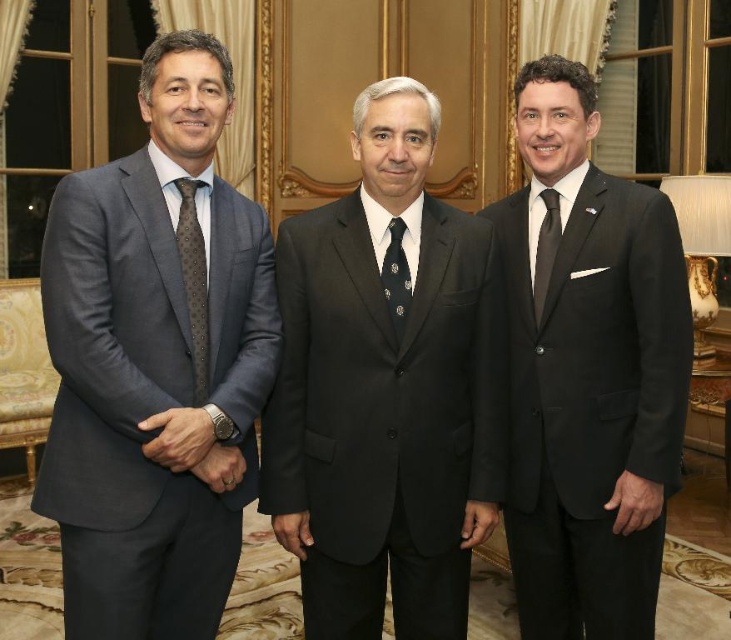
Who is positioned more to the left, dark gray dotted tie at left or black silk tie at right?

dark gray dotted tie at left is more to the left.

Which is in front, point (194, 240) or point (548, 205)?

Point (194, 240) is more forward.

Which is in front, point (185, 212) or point (539, 250)?

Positioned in front is point (185, 212).

Image resolution: width=731 pixels, height=640 pixels. Find the location of `dark gray dotted tie at left`. dark gray dotted tie at left is located at coordinates (194, 282).

Which is below, matte gray suit at left or dark gray dotted tie at left?

matte gray suit at left

Where is `matte gray suit at left`? The image size is (731, 640). matte gray suit at left is located at coordinates (156, 362).

Is matte black suit at right above black silk tie at right?

No, matte black suit at right is not above black silk tie at right.

Is matte black suit at right closer to camera compared to black silk tie at right?

Yes, it is in front of black silk tie at right.

What do you see at coordinates (588, 372) in the screenshot?
I see `matte black suit at right` at bounding box center [588, 372].

At what (x,y) coordinates should I click in order to perform the action: click on matte black suit at right. Please return your answer as a coordinate pair (x, y). The image size is (731, 640). Looking at the image, I should click on (588, 372).